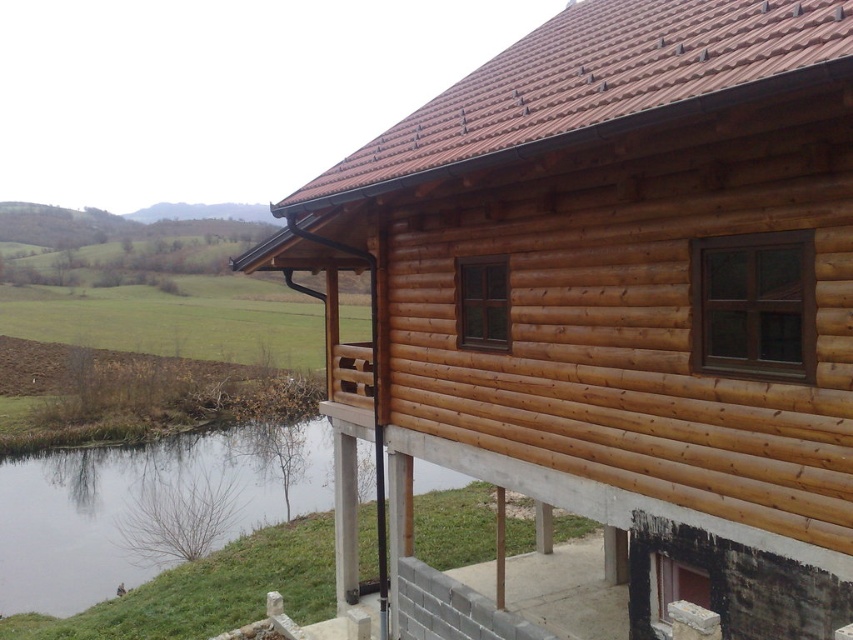
Is the position of natural wood cabin at upper right more distant than that of green grassy river at lower left?

No, natural wood cabin at upper right is closer to the viewer.

Between point (427, 432) and point (28, 579), which one is positioned in front?

Point (427, 432) is in front.

Who is more distant from viewer, (x=850, y=344) or (x=450, y=476)?

The point (x=450, y=476) is behind.

Image resolution: width=853 pixels, height=640 pixels. Identify the location of natural wood cabin at upper right. (608, 314).